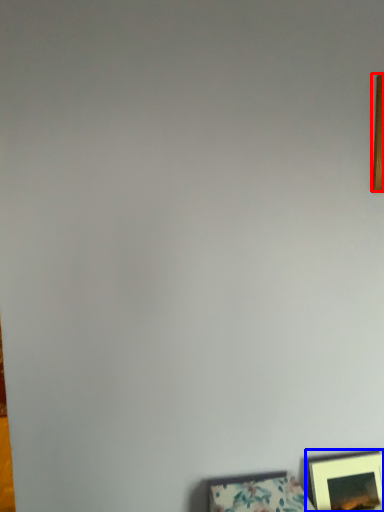
Question: Which object appears farthest to the camera in this image, picture frame (highlighted by a red box) or picture frame (highlighted by a blue box)?

Choices:
 (A) picture frame
 (B) picture frame

Answer: (B)